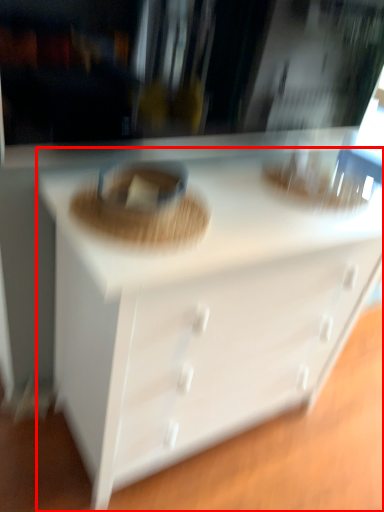
Question: Considering the relative positions of chest of drawers (annotated by the red box) and food in the image provided, where is chest of drawers (annotated by the red box) located with respect to the staircase?

Choices:
 (A) left
 (B) right

Answer: (B)